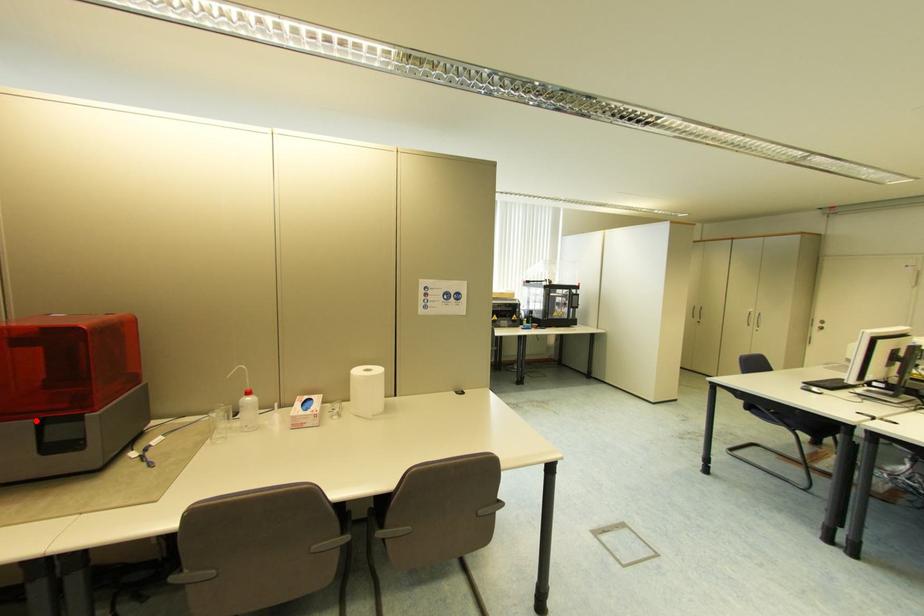
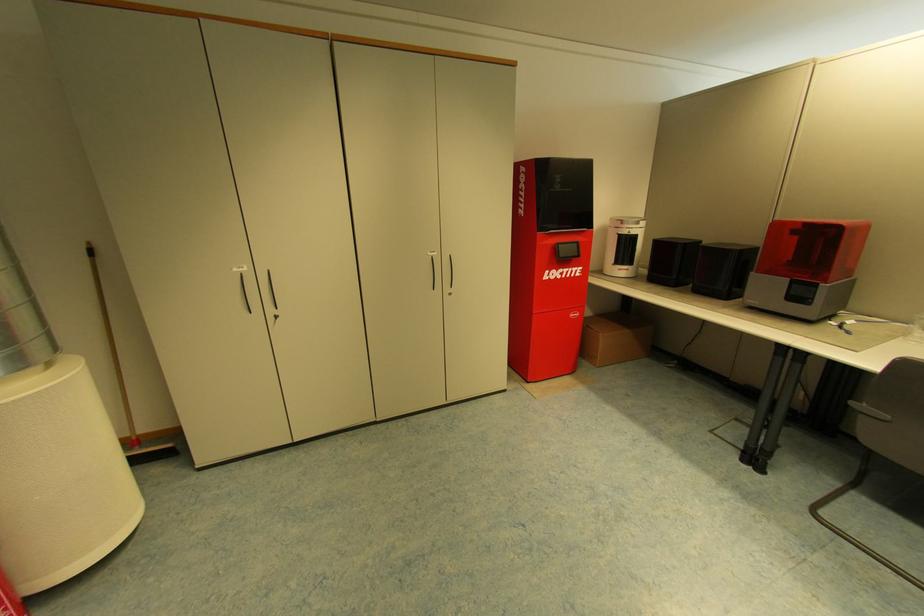
The point at the highlighted location is marked in the first image. Where is the corresponding point in the second image?

(793, 280)